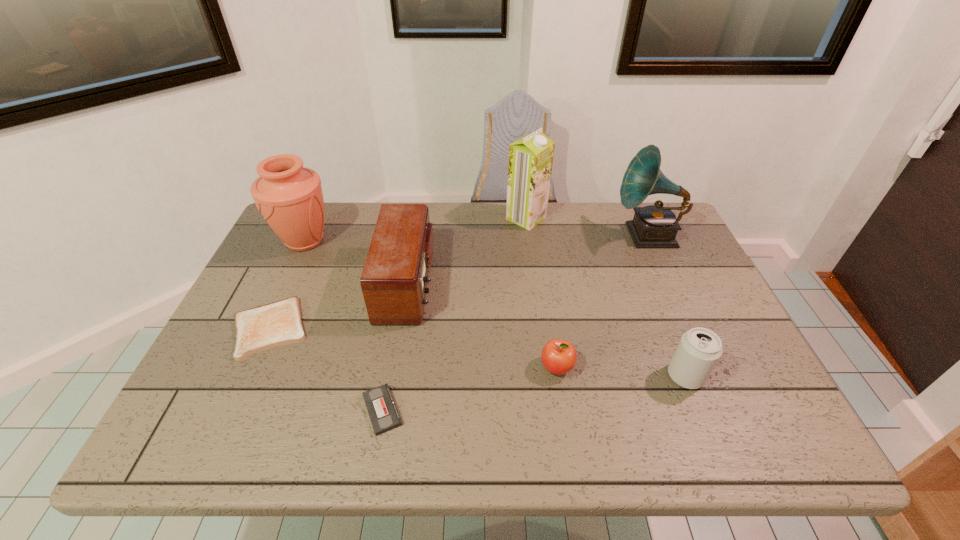
This screenshot has height=540, width=960. In order to click on free spot at the near edge of the desktop in this screenshot , I will do click(x=297, y=443).

Find the location of a particular element. The width and height of the screenshot is (960, 540). free location at the left edge is located at coordinates (272, 352).

The width and height of the screenshot is (960, 540). In the image, there is a desktop. Identify the location of vacant space at the right edge. (763, 379).

Locate an element on the screen. This screenshot has width=960, height=540. vacant space at the far left corner is located at coordinates point(327,231).

The height and width of the screenshot is (540, 960). In the image, there is a desktop. In order to click on vacant area at the near left corner in this screenshot , I will do `click(182, 423)`.

Where is `vacant space at the near right corner of the desktop`? The height and width of the screenshot is (540, 960). vacant space at the near right corner of the desktop is located at coordinates pyautogui.click(x=773, y=437).

Where is `vacant space that's between the videotape and the phonograph_record`? The width and height of the screenshot is (960, 540). vacant space that's between the videotape and the phonograph_record is located at coordinates (515, 322).

At what (x,y) coordinates should I click in order to perform the action: click on vacant area between the toast and the vase. Please return your answer as a coordinate pair (x, y). Looking at the image, I should click on (287, 285).

Where is `free spot between the apple and the vase`? The height and width of the screenshot is (540, 960). free spot between the apple and the vase is located at coordinates (431, 304).

Where is `unoccupied area between the can and the third shortest object`? The width and height of the screenshot is (960, 540). unoccupied area between the can and the third shortest object is located at coordinates (621, 372).